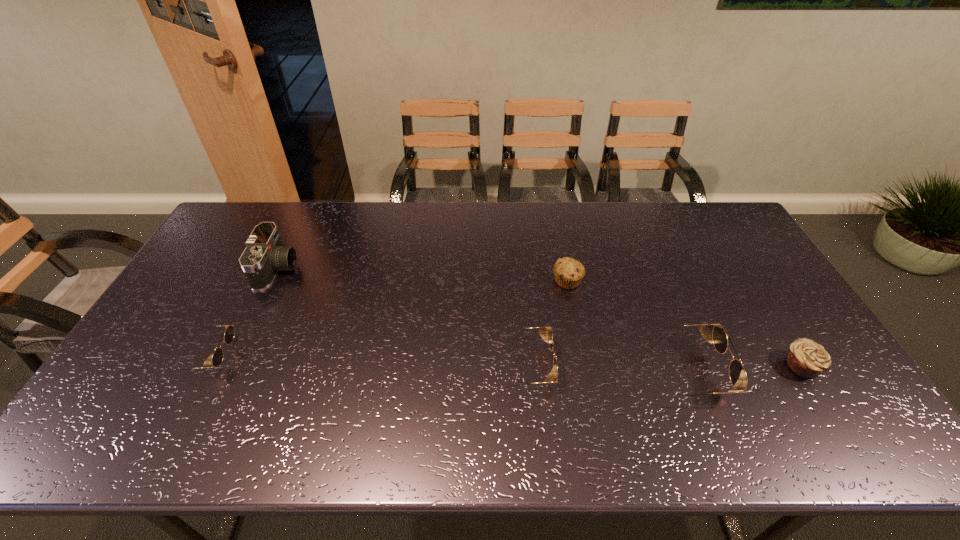
You are a GUI agent. You are given a task and a screenshot of the screen. Output one action in this format:
    pyautogui.click(x=<x>, y=<y>)
    Task: Click on the free space located on the front lenses of the leftmost sunglasses
    
    Given the screenshot: What is the action you would take?
    pyautogui.click(x=330, y=356)

At what (x,y) coordinates should I click in order to perform the action: click on vacant space located on the front lenses of the second tallest sunglasses. Please return your answer as a coordinate pair (x, y). Looking at the image, I should click on (x=672, y=366).

Identify the location of vacant region located on the front lenses of the tallest sunglasses. (815, 372).

Identify the location of vacant space located on the left of the left muffin. This screenshot has width=960, height=540. pyautogui.click(x=435, y=280).

Where is `free space located 0.260m on the front-facing side of the camera`? The height and width of the screenshot is (540, 960). free space located 0.260m on the front-facing side of the camera is located at coordinates (375, 269).

Locate an element on the screen. The width and height of the screenshot is (960, 540). vacant space located on the left of the nearer muffin is located at coordinates (651, 366).

Locate an element on the screen. The image size is (960, 540). muffin that is at the near edge is located at coordinates (806, 358).

I want to click on object present at the left edge, so click(x=217, y=358).

I want to click on object that is positioned at the right edge, so click(x=806, y=358).

Image resolution: width=960 pixels, height=540 pixels. Find the location of `object at the near right corner`. object at the near right corner is located at coordinates (806, 358).